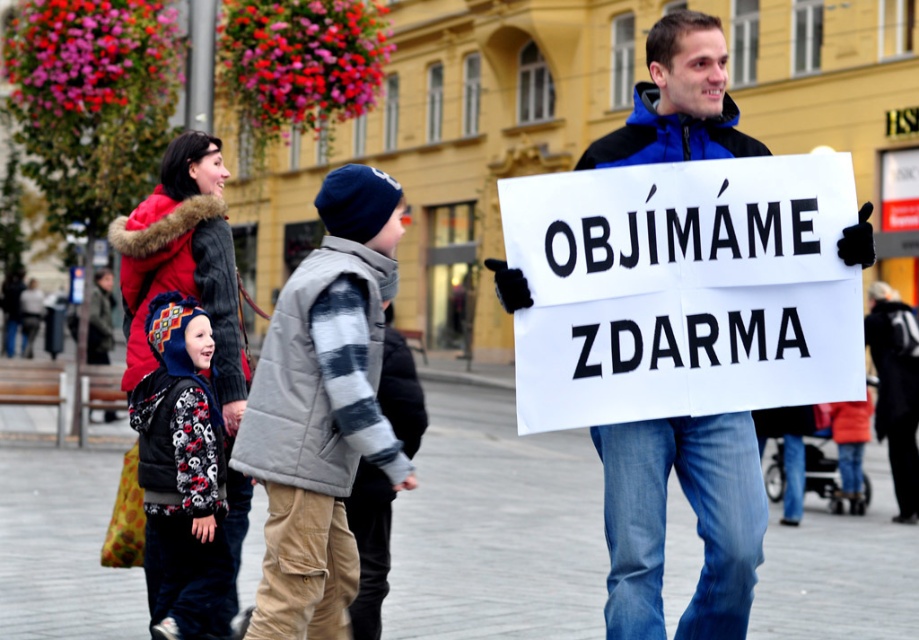
Between white paper sign at center and gray quilted vest at center, which one is positioned lower?

gray quilted vest at center

Who is shorter, white paper sign at center or gray quilted vest at center?

With less height is white paper sign at center.

Is point (818, 198) positioned behind point (358, 246)?

No.

The width and height of the screenshot is (919, 640). In order to click on white paper sign at center in this screenshot , I will do `click(683, 289)`.

Does point (320, 204) come behind point (173, 490)?

No, (320, 204) is in front of (173, 490).

Is gray quilted vest at center shorter than printed fleece jacket at center?

Yes, gray quilted vest at center is shorter than printed fleece jacket at center.

Between point (394, 280) and point (191, 360), which one is positioned behind?

Positioned behind is point (191, 360).

Find the location of a particular element. This screenshot has width=919, height=640. gray quilted vest at center is located at coordinates (323, 408).

Who is shorter, printed fleece jacket at center or dark blue knit hat at upper left?

printed fleece jacket at center

Is printed fleece jacket at center to the right of dark blue knit hat at upper left from the viewer's perspective?

No, printed fleece jacket at center is not to the right of dark blue knit hat at upper left.

Who is more forward, (x=206, y=592) or (x=885, y=323)?

→ Point (x=206, y=592) is more forward.

Identify the location of printed fleece jacket at center. (180, 468).